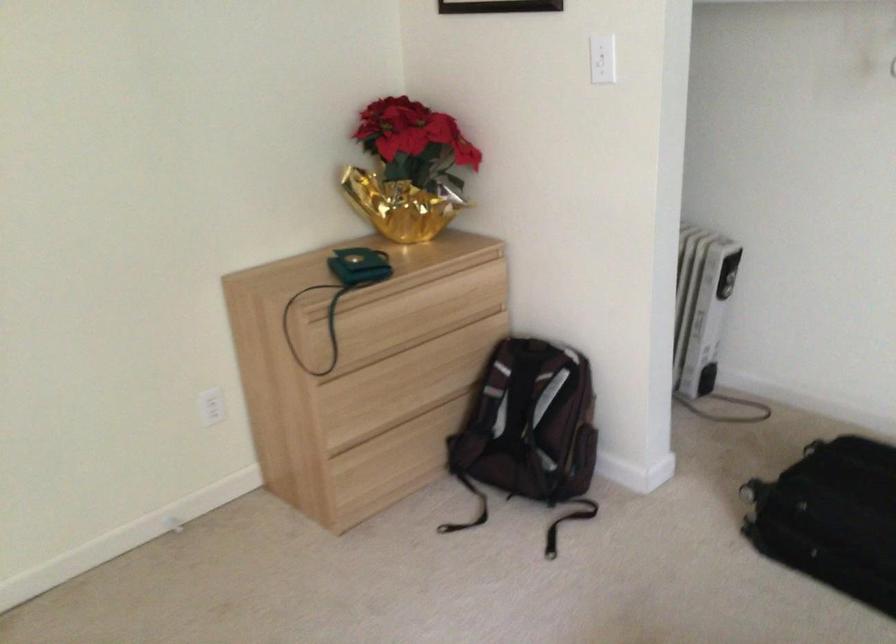
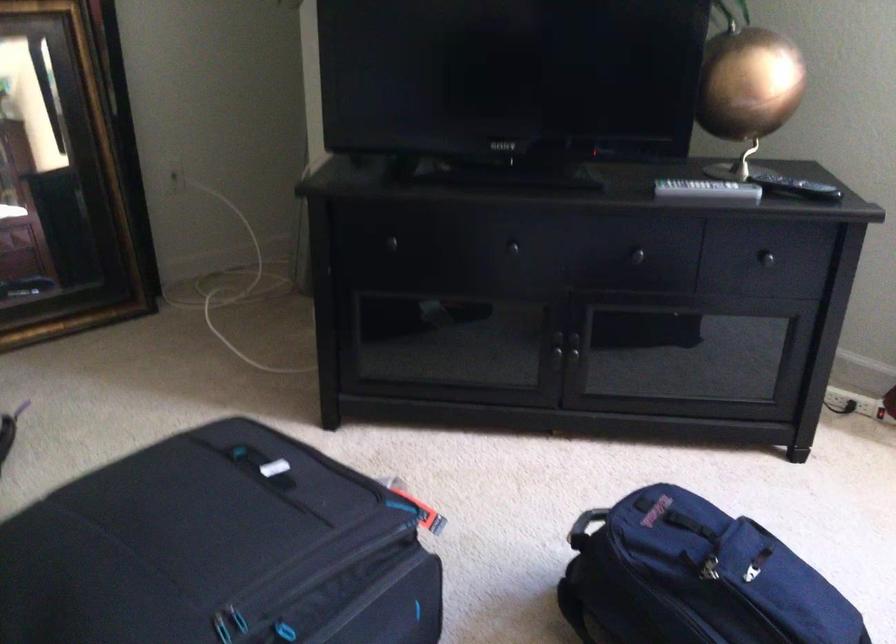
Question: Based on the continuous images, in which direction is the camera rotating? Reply with the corresponding letter.

Choices:
 (A) Left
 (B) Right
 (C) Up
 (D) Down

Answer: (B)